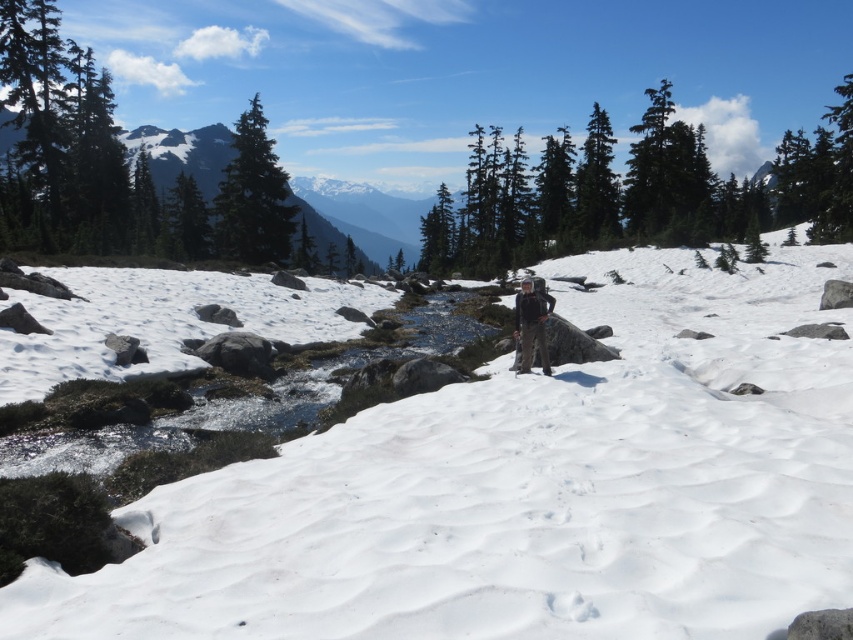
How far apart are snowy granite mountain at upper left and green matte pine at upper left?

snowy granite mountain at upper left is 154.98 meters away from green matte pine at upper left.

Between snowy granite mountain at upper left and green matte pine at upper left, which one is positioned lower?

Positioned lower is green matte pine at upper left.

Does point (223, 164) come in front of point (247, 218)?

No, it is behind (247, 218).

The width and height of the screenshot is (853, 640). Identify the location of snowy granite mountain at upper left. (360, 216).

Does white fluffy snow at center have a greater height compared to matte black backpack at center?

Yes, white fluffy snow at center is taller than matte black backpack at center.

This screenshot has height=640, width=853. I want to click on white fluffy snow at center, so click(527, 490).

Between point (257, 224) and point (538, 330), which one is positioned behind?

Point (257, 224)

Where is `green matte pine at upper left`? Image resolution: width=853 pixels, height=640 pixels. green matte pine at upper left is located at coordinates (253, 196).